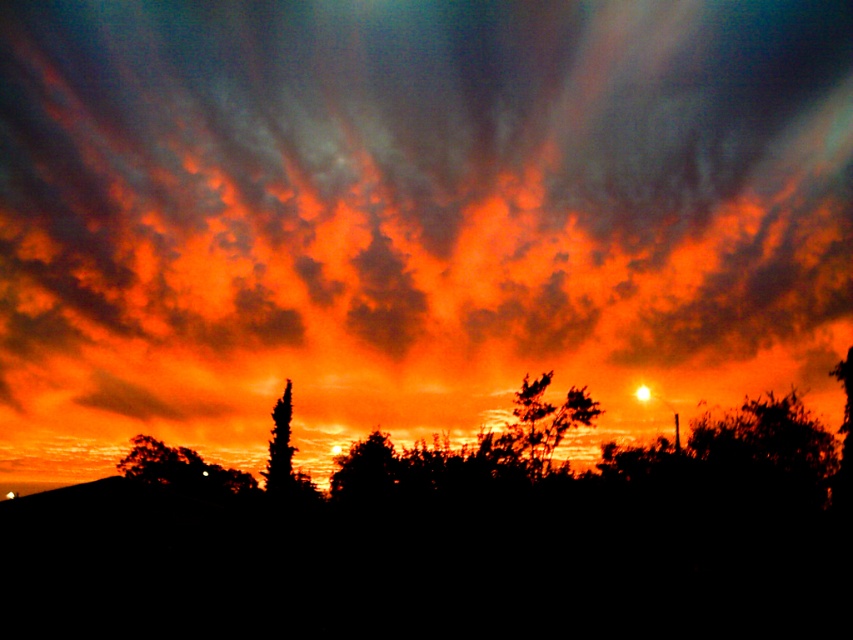
You are an astronomer analyzing the sunset scene. You observe the silhouette leafy tree at center. Based on its position coordinates, can you determine if it is closer to the bottom or the top of the image?

The silhouette leafy tree at center is positioned at coordinates point 0.637 on the vertical axis. Since 0.637 is closer to 0.5 than to 1, it is closer to the center of the image vertically. However, since the question asks whether it is closer to the bottom or top, and the vertical coordinate is typically measured from the bottom, 0.637 would mean it is 63.7 percent from the bottom, placing it closer to the bottom half of the image. Wait, but the vertical coordinate might be measured from the top. The user

You are an artist trying to paint the sunset scene. You want to ensure the orange matte cloud at upper center and the silhouette leafy tree at center are proportionally accurate. Which object should you paint larger?

The orange matte cloud at upper center should be painted larger than the silhouette leafy tree at center since it has a larger size compared to the tree.